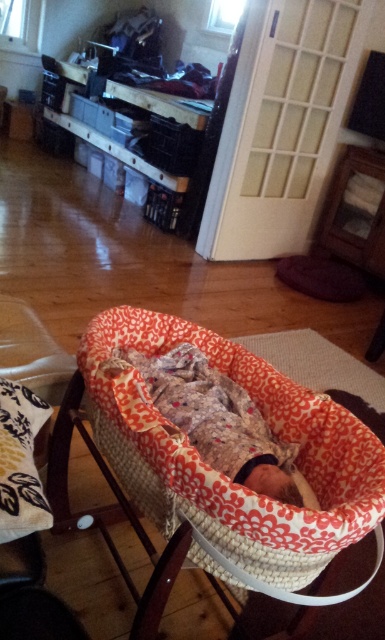
You are a parent who wants to ensure the baby in the floral fabric bassinet at center is comfortable. Since the floral fabric baby at center is smaller than the bassinet, what might you need to do to make sure the baby stays secure and doesn

The floral fabric bassinet at center is bigger than the floral fabric baby at center. To ensure the baby stays secure, you could place rolled blankets or approved sleep positioners on both sides of the baby to prevent rolling or shifting within the larger space of the bassinet.

You are a parent holding a small toy and want to place it near the floral fabric bassinet at center and the floral fabric baby at center. Which object should you place the toy closer to if you want it to appear larger in the photo you take?

The toy should be placed closer to the floral fabric bassinet at center because objects closer to the viewer appear larger in a photo.